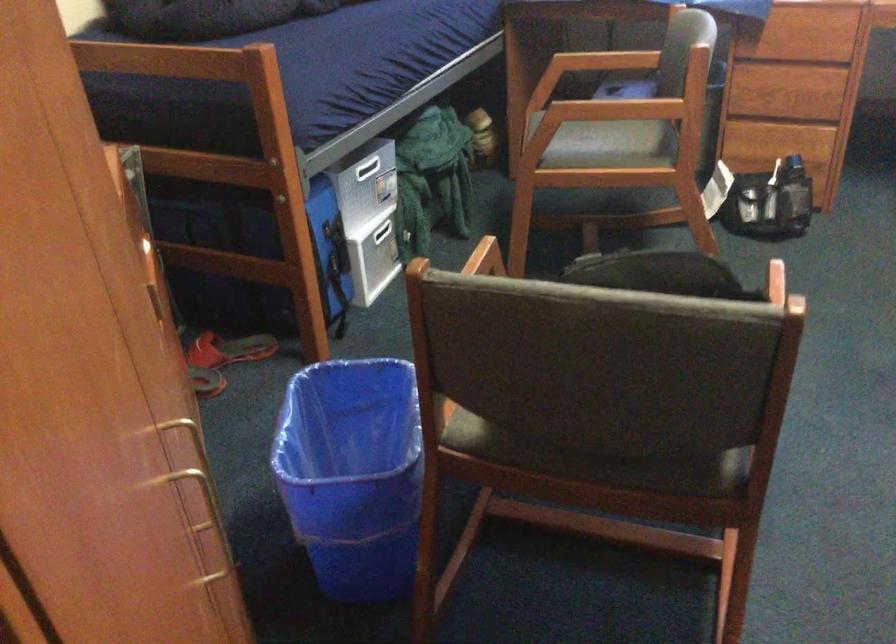
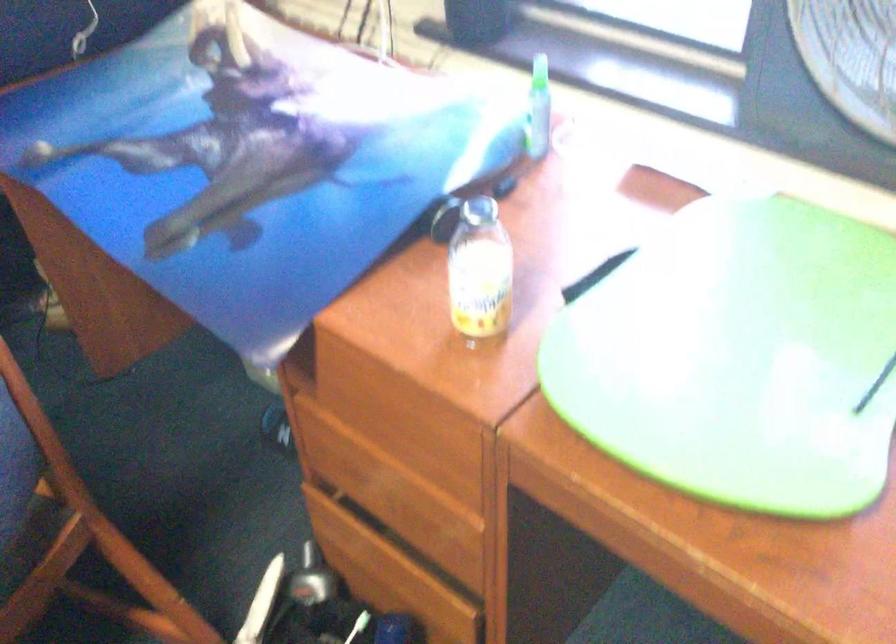
Locate, in the second image, the point that corresponds to (659,124) in the first image.

(30, 540)